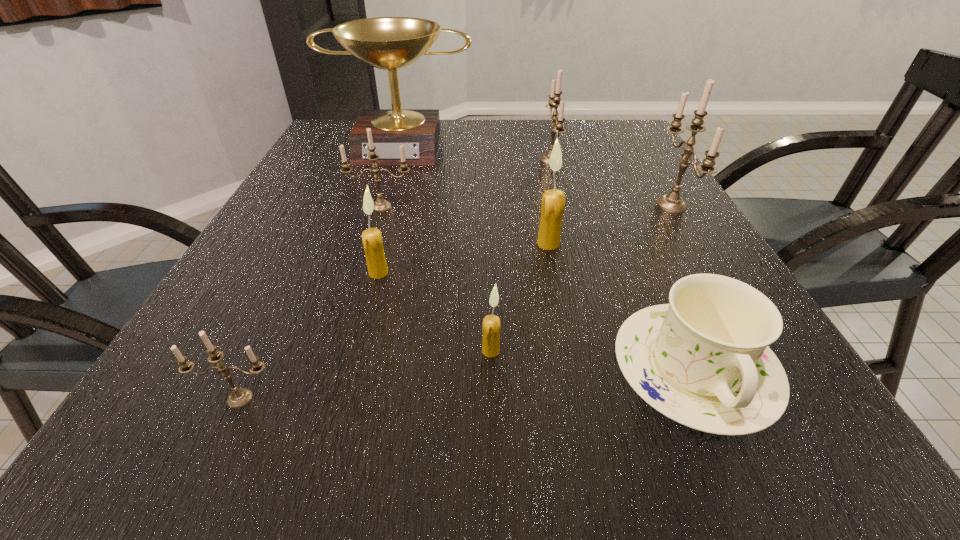
Identify the location of award. The image size is (960, 540). (390, 43).

Image resolution: width=960 pixels, height=540 pixels. In order to click on the tallest candle in this screenshot , I will do `click(672, 202)`.

You are a GUI agent. You are given a task and a screenshot of the screen. Output one action in this format:
    pyautogui.click(x=<x>, y=<y>)
    Task: Click on the rightmost metallic candle
    
    Given the screenshot: What is the action you would take?
    [x=672, y=202]

Where is `the third smallest metallic candle`? the third smallest metallic candle is located at coordinates (555, 100).

Identify the location of the third metallic candle from left to right. click(555, 100).

The image size is (960, 540). I want to click on the biggest cream candle, so click(x=553, y=201).

In order to click on the fourth farthest candle in this screenshot , I will do `click(553, 201)`.

Identify the location of the sixth farthest object. This screenshot has width=960, height=540. (377, 267).

Identify the location of the fifth farthest candle. (377, 267).

The height and width of the screenshot is (540, 960). In order to click on the second smallest metallic candle in this screenshot , I will do `click(380, 205)`.